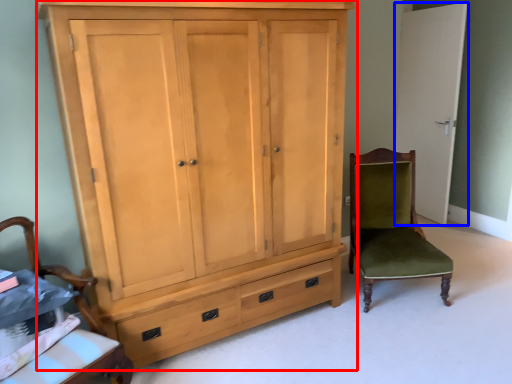
Question: Which point is closer to the camera, cupboard (highlighted by a red box) or door (highlighted by a blue box)?

Choices:
 (A) cupboard
 (B) door

Answer: (A)